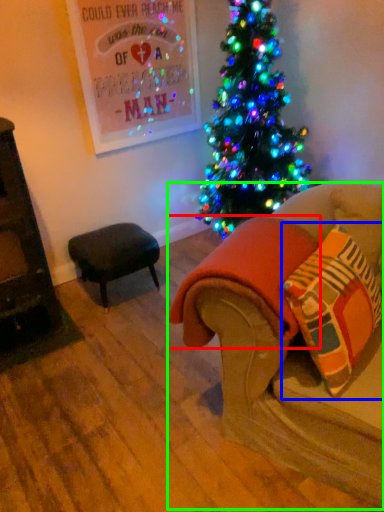
Question: Based on their relative distances, which object is nearer to blanket (highlighted by a red box)? Choose from throw pillow (highlighted by a blue box) and studio couch (highlighted by a green box).

Choices:
 (A) throw pillow
 (B) studio couch

Answer: (B)